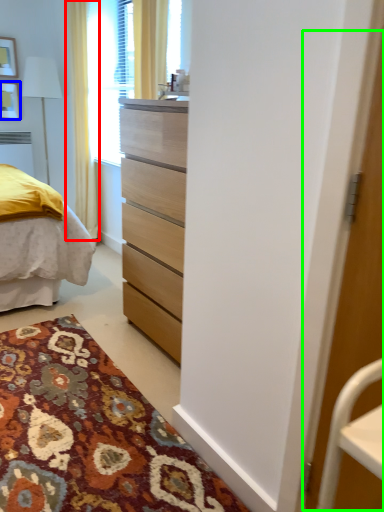
Question: Considering the real-world distances, which object is closest to curtain (highlighted by a red box)? picture frame (highlighted by a blue box) or screen door (highlighted by a green box).

Choices:
 (A) picture frame
 (B) screen door

Answer: (A)